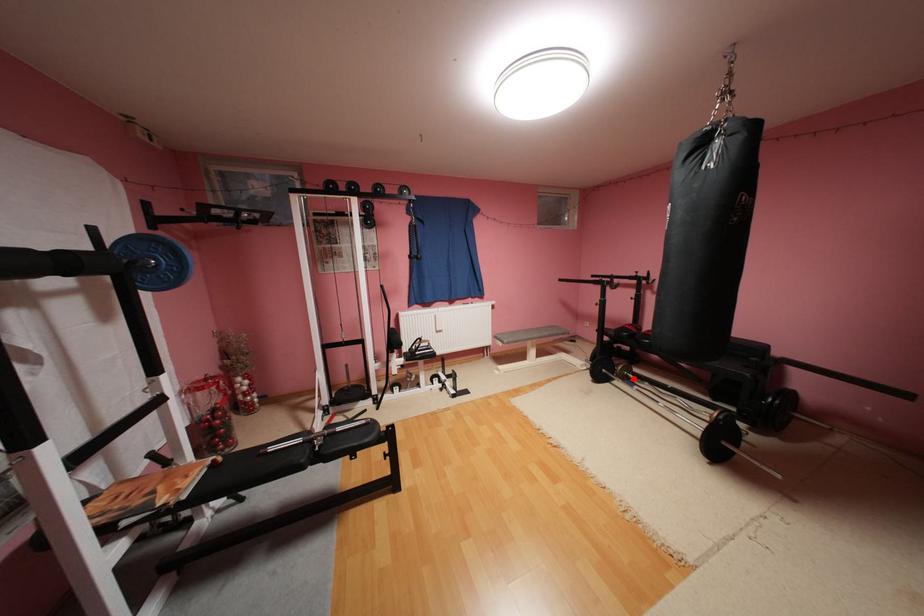
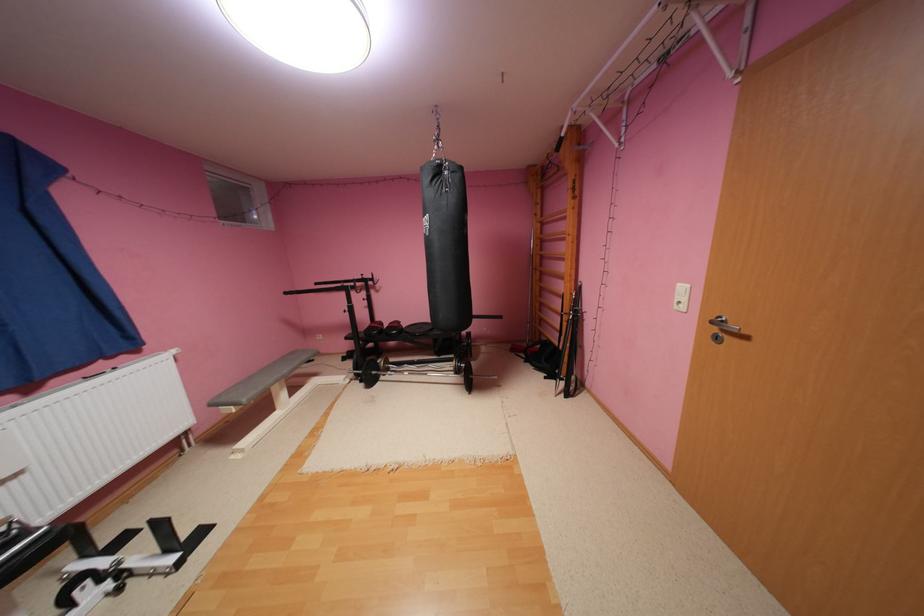
The point at the highlighted location is marked in the first image. Where is the corresponding point in the second image?

(396, 371)